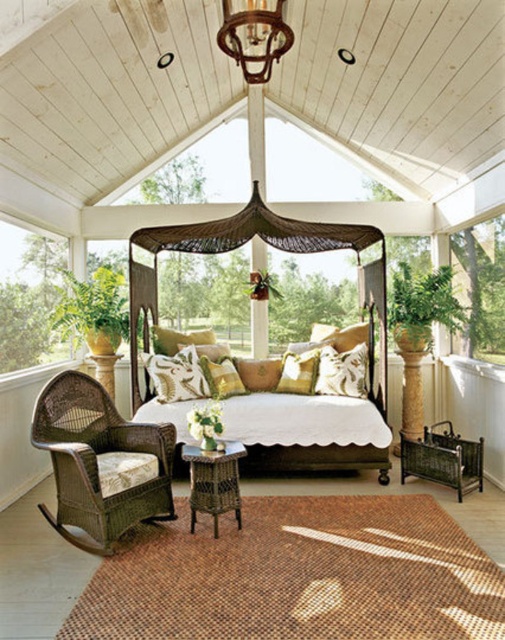
Does rattan canopy bed at center have a greater height compared to transparent glass window at upper right?

Correct, rattan canopy bed at center is much taller as transparent glass window at upper right.

The width and height of the screenshot is (505, 640). What do you see at coordinates (237, 248) in the screenshot?
I see `rattan canopy bed at center` at bounding box center [237, 248].

Between point (280, 244) and point (483, 268), which one is positioned in front?

Point (483, 268)

Where is `rattan canopy bed at center`? This screenshot has width=505, height=640. rattan canopy bed at center is located at coordinates (237, 248).

Who is more forward, (49, 259) or (366, 376)?

Positioned in front is point (366, 376).

Which of these two, transparent glass window at left or white cotton pillow at center, stands shorter?

white cotton pillow at center

What are the coordinates of `transparent glass window at left` in the screenshot? It's located at (29, 296).

Which is more to the right, rattan canopy bed at center or white cotton pillow at center?

Positioned to the right is white cotton pillow at center.

Between rattan canopy bed at center and white cotton pillow at center, which one has more height?

With more height is rattan canopy bed at center.

Between point (373, 355) and point (329, 355), which one is positioned behind?

The point (373, 355) is behind.

Locate an element on the screen. rattan canopy bed at center is located at coordinates (237, 248).